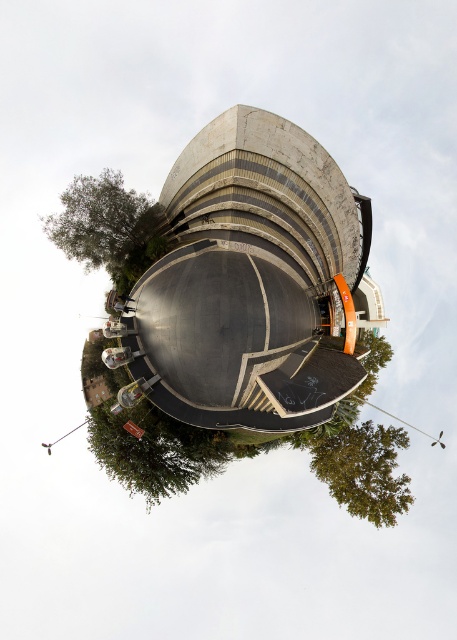
Looking at this image, can you confirm if green leafy tree at upper left is positioned below green leafy tree at lower right?

Incorrect, green leafy tree at upper left is not positioned below green leafy tree at lower right.

Between green leafy tree at upper left and green leafy tree at lower right, which one is positioned lower?

green leafy tree at lower right

Is point (138, 195) more distant than point (315, 436)?

That is True.

The image size is (457, 640). Identify the location of green leafy tree at upper left. (107, 227).